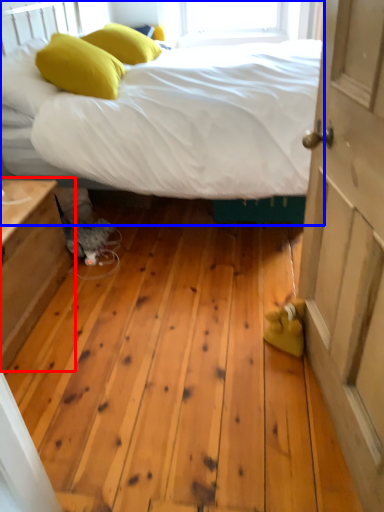
Question: Which of the following is the farthest to the observer, nightstand (highlighted by a red box) or bed (highlighted by a blue box)?

Choices:
 (A) nightstand
 (B) bed

Answer: (B)